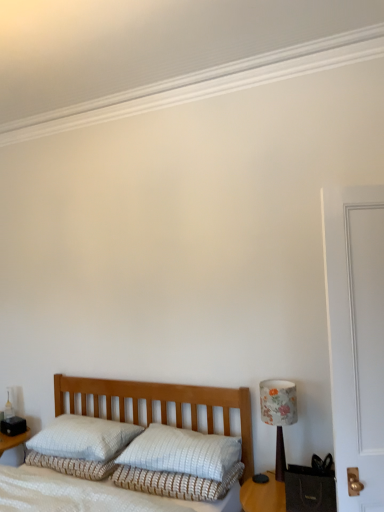
Question: Are white textured pillow at center, placed as the 1th pillow when sorted from left to right, and floral fabric lampshade at right far apart?

Choices:
 (A) yes
 (B) no

Answer: (A)

Question: Is floral fabric lampshade at right a part of white textured pillow at center, which is the 2th pillow from right to left?

Choices:
 (A) yes
 (B) no

Answer: (B)

Question: Is white textured pillow at center, placed as the 1th pillow when sorted from left to right, not inside floral fabric lampshade at right?

Choices:
 (A) yes
 (B) no

Answer: (A)

Question: Can you confirm if white textured pillow at center, placed as the 1th pillow when sorted from left to right, is smaller than floral fabric lampshade at right?

Choices:
 (A) no
 (B) yes

Answer: (A)

Question: Is white textured pillow at center, placed as the 1th pillow when sorted from left to right, turned away from floral fabric lampshade at right?

Choices:
 (A) no
 (B) yes

Answer: (A)

Question: Does point click(61, 379) appear closer or farther from the camera than point click(104, 425)?

Choices:
 (A) closer
 (B) farther

Answer: (B)

Question: Considering their positions, is white textured bed at center located in front of or behind white textured pillow at center, placed as the 1th pillow when sorted from left to right?

Choices:
 (A) behind
 (B) front

Answer: (B)

Question: Considering the positions of white textured bed at center and white textured pillow at center, which is the 2th pillow from right to left, in the image, is white textured bed at center taller or shorter than white textured pillow at center, which is the 2th pillow from right to left,?

Choices:
 (A) tall
 (B) short

Answer: (A)

Question: In terms of width, does white textured bed at center look wider or thinner when compared to white textured pillow at center, placed as the 1th pillow when sorted from left to right?

Choices:
 (A) thin
 (B) wide

Answer: (B)

Question: Based on their positions, is white textured pillow at center located to the left or right of floral fabric lampshade at right?

Choices:
 (A) left
 (B) right

Answer: (A)

Question: Is white textured pillow at center inside the boundaries of floral fabric lampshade at right, or outside?

Choices:
 (A) outside
 (B) inside

Answer: (A)

Question: From a real-world perspective, is white textured pillow at center physically located above or below floral fabric lampshade at right?

Choices:
 (A) above
 (B) below

Answer: (B)

Question: Looking at their shapes, would you say white textured pillow at center is wider or thinner than floral fabric lampshade at right?

Choices:
 (A) thin
 (B) wide

Answer: (B)

Question: Does point (165, 437) appear closer or farther from the camera than point (268, 483)?

Choices:
 (A) closer
 (B) farther

Answer: (B)

Question: Looking at the image, does white textured pillow at center, which appears as the 2th pillow when viewed from the left, seem bigger or smaller compared to wooden table at lower right?

Choices:
 (A) small
 (B) big

Answer: (A)